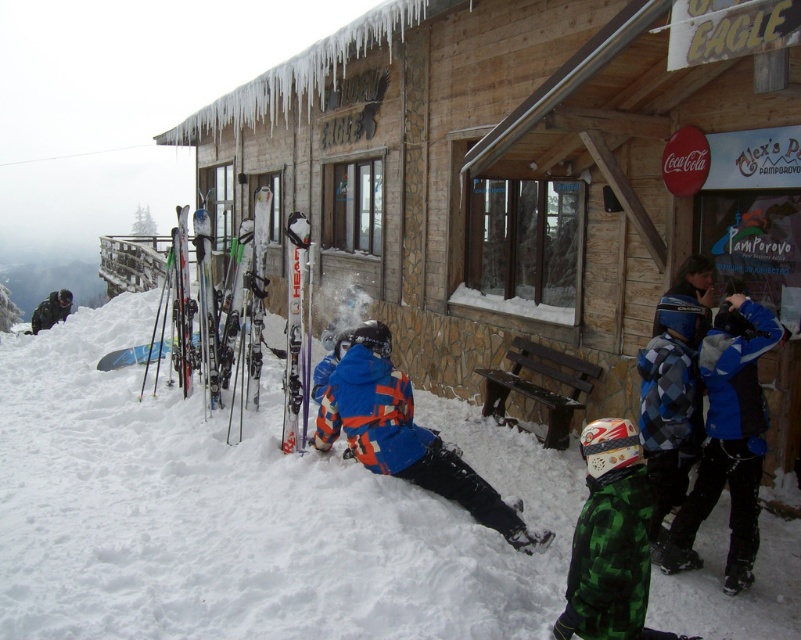
You are a photographer trying to capture both the blue checkered jacket at center right and the white metallic ski at center from your current position. Which object would appear bigger in your photo?

The blue checkered jacket at center right would appear bigger in the photo because it has a larger size compared to the white metallic ski at center.

You are a winter sports enthusiast planning to rent equipment. You see the blue plaid snowboard at center and the shiny metallic ski at left. Which one is shorter?

The blue plaid snowboard at center is shorter than the shiny metallic ski at left.